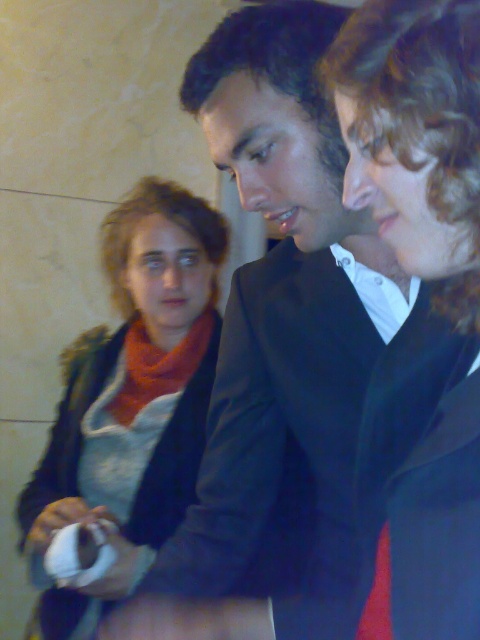
Is point (412, 161) in front of point (225, 228)?

Yes, point (412, 161) is closer to viewer.

Can you confirm if matte black jacket at center is taller than matte orange scarf at upper left?

No.

Is point (437, 497) closer to camera compared to point (117, 252)?

Yes, it is in front of point (117, 252).

In order to click on matte black jacket at center in this screenshot , I will do `click(416, 134)`.